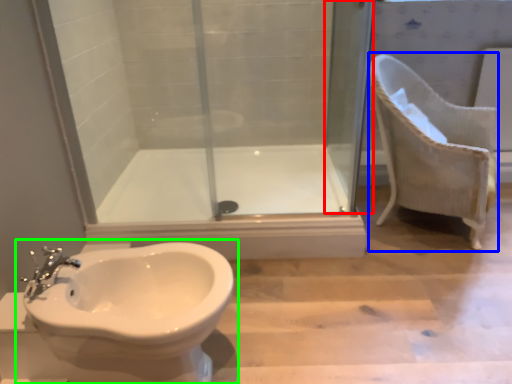
Question: Based on their relative distances, which object is farther from screen door (highlighted by a red box)? Choose from armchair (highlighted by a blue box) and toilet (highlighted by a green box).

Choices:
 (A) armchair
 (B) toilet

Answer: (B)